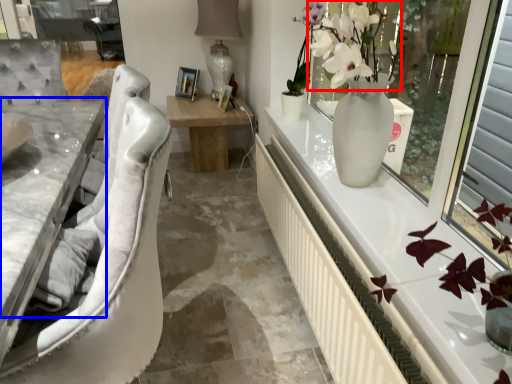
Question: Among these objects, which one is nearest to the camera, floral arrangement (highlighted by a red box) or counter top (highlighted by a blue box)?

Choices:
 (A) floral arrangement
 (B) counter top

Answer: (B)